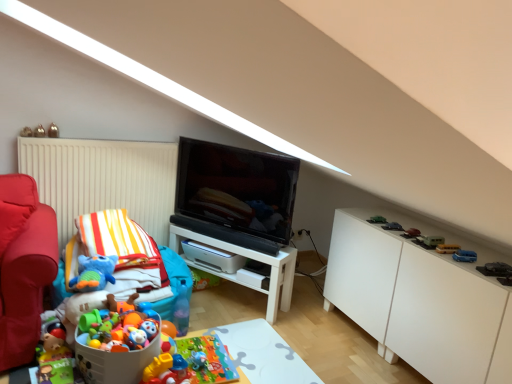
What do you see at coordinates (39, 131) in the screenshot? Image resolution: width=512 pixels, height=384 pixels. I see `metallic gold toy at upper left, which is counted as the 1th toy, starting from the left` at bounding box center [39, 131].

You are a GUI agent. You are given a task and a screenshot of the screen. Output one action in this format:
    pyautogui.click(x=<x>, y=<y>)
    Task: Click on the metallic silver car at upper right, the 6th toy viewed from the right
    
    Given the screenshot: What is the action you would take?
    pyautogui.click(x=392, y=226)

How much space does white matte table at center, marked as the second table in a front-to-back arrangement, occupy horizontally?

white matte table at center, marked as the second table in a front-to-back arrangement, is 10.45 inches in width.

This screenshot has height=384, width=512. What do you see at coordinates (411, 233) in the screenshot?
I see `shiny red car at right, the 8th toy in the left-to-right sequence` at bounding box center [411, 233].

The image size is (512, 384). I want to click on green matte toy car at right, which is the fourth toy from right to left, so click(x=429, y=241).

The image size is (512, 384). I want to click on yellow matte school bus at right, placed as the 6th toy when sorted from bottom to top, so click(x=447, y=248).

Which is more to the left, blue plush toy at left, which is the ninth toy in right-to-left order, or metallic silver toy at upper left, placed as the 12th toy when sorted from bottom to top?

metallic silver toy at upper left, placed as the 12th toy when sorted from bottom to top, is more to the left.

Is blue plush toy at left, arranged as the tenth toy when viewed from the top, positioned before metallic silver toy at upper left, arranged as the 11th toy when viewed from the right?

Yes, blue plush toy at left, arranged as the tenth toy when viewed from the top, is closer to the viewer.

Based on their sizes in the image, would you say blue plush toy at left, marked as the fourth toy in a left-to-right arrangement, is bigger or smaller than metallic silver toy at upper left, which is counted as the 1th toy, starting from the top?

blue plush toy at left, marked as the fourth toy in a left-to-right arrangement, is bigger than metallic silver toy at upper left, which is counted as the 1th toy, starting from the top.

In the scene shown: Which is closer, (105, 282) or (50, 131)?

The point (105, 282) is closer to the camera.

From a real-world perspective, between green matte toy car at right, which is the 6th toy from top to bottom, and matte black tv at center, who is vertically lower?

In real-world perspective, green matte toy car at right, which is the 6th toy from top to bottom, is lower.

Considering the sizes of green matte toy car at right, which appears as the 9th toy when viewed from the left, and matte black tv at center in the image, is green matte toy car at right, which appears as the 9th toy when viewed from the left, bigger or smaller than matte black tv at center?

In the image, green matte toy car at right, which appears as the 9th toy when viewed from the left, appears to be smaller than matte black tv at center.

Looking at this image, what's the angular difference between green matte toy car at right, the 7th toy ordered from the bottom, and matte black tv at center's facing directions?

The angle between the facing direction of green matte toy car at right, the 7th toy ordered from the bottom, and the facing direction of matte black tv at center is 44.2 degrees.

Considering the relative sizes of green matte toy car at right, the 7th toy ordered from the bottom, and matte black tv at center in the image provided, is green matte toy car at right, the 7th toy ordered from the bottom, shorter than matte black tv at center?

Yes, green matte toy car at right, the 7th toy ordered from the bottom, is shorter than matte black tv at center.

Looking at this image, is white matte table at center, the second table in the bottom-to-top sequence, looking in the opposite direction of green matte toy car at right, which appears as the 9th toy when viewed from the left?

That's not correct — white matte table at center, the second table in the bottom-to-top sequence, is not looking away from green matte toy car at right, which appears as the 9th toy when viewed from the left.

Considering the sizes of objects white matte table at center, placed as the 1th table when sorted from top to bottom, and green matte toy car at right, the 7th toy ordered from the bottom, in the image provided, who is thinner, white matte table at center, placed as the 1th table when sorted from top to bottom, or green matte toy car at right, the 7th toy ordered from the bottom,?

With smaller width is green matte toy car at right, the 7th toy ordered from the bottom.

Considering the relative sizes of white matte table at center, marked as the second table in a front-to-back arrangement, and green matte toy car at right, the 7th toy ordered from the bottom, in the image provided, is white matte table at center, marked as the second table in a front-to-back arrangement, smaller than green matte toy car at right, the 7th toy ordered from the bottom,?

Actually, white matte table at center, marked as the second table in a front-to-back arrangement, might be larger than green matte toy car at right, the 7th toy ordered from the bottom.

Can you tell me how much white matte table at center, marked as the 1th table in a back-to-front arrangement, and green matte toy car at right, the 7th toy ordered from the bottom, differ in facing direction?

The angle between the facing direction of white matte table at center, marked as the 1th table in a back-to-front arrangement, and the facing direction of green matte toy car at right, the 7th toy ordered from the bottom, is 44.7 degrees.

In the scene shown: Is yellow matte school bus at right, placed as the 6th toy when sorted from bottom to top, beside metallic gold toy at upper left, the twelfth toy when ordered from right to left?

No, yellow matte school bus at right, placed as the 6th toy when sorted from bottom to top, is not next to metallic gold toy at upper left, the twelfth toy when ordered from right to left.

Between point (453, 244) and point (42, 128), which one is positioned in front?

The point (453, 244) is closer.

Is yellow matte school bus at right, the tenth toy when ordered from left to right, inside or outside of metallic gold toy at upper left, the 11th toy ordered from the bottom?

yellow matte school bus at right, the tenth toy when ordered from left to right, exists outside the volume of metallic gold toy at upper left, the 11th toy ordered from the bottom.

Who is shorter, yellow matte school bus at right, the tenth toy when ordered from left to right, or metallic gold toy at upper left, which is counted as the 1th toy, starting from the left?

yellow matte school bus at right, the tenth toy when ordered from left to right.

Does point (58, 133) lie behind point (23, 286)?

Yes, it is.

Looking at their sizes, would you say metallic silver toy at upper left, arranged as the 11th toy when viewed from the right, is wider or thinner than matte red sofa at left?

Considering their sizes, metallic silver toy at upper left, arranged as the 11th toy when viewed from the right, looks slimmer than matte red sofa at left.

From a real-world perspective, is metallic silver toy at upper left, which is counted as the 1th toy, starting from the top, over matte red sofa at left?

Yes, from a real-world perspective, metallic silver toy at upper left, which is counted as the 1th toy, starting from the top, is on top of matte red sofa at left.

Identify the location of the 2nd toy in front of the matte black tv at center. This screenshot has width=512, height=384. (411, 233).

Is shiny red car at right, the fifth toy when ordered from top to bottom, turned away from matte black tv at center?

No, shiny red car at right, the fifth toy when ordered from top to bottom, is not facing the opposite direction of matte black tv at center.

Which is correct: shiny red car at right, the fifth toy when ordered from top to bottom, is inside matte black tv at center, or outside of it?

shiny red car at right, the fifth toy when ordered from top to bottom, is located beyond the bounds of matte black tv at center.

Which toy is the 5th one when counting from the right side of the translucent plastic blocks at center, which is the 12th toy from top to bottom? Please provide its 2D coordinates.

[(447, 248)]

What's the angular difference between translucent plastic blocks at center, which appears as the eighth toy when viewed from the right, and yellow matte school bus at right, the 7th toy viewed from the top,'s facing directions?

They differ by 126 degrees in their facing directions.

In the image, is translucent plastic blocks at center, which is counted as the fifth toy, starting from the left, positioned in front of or behind yellow matte school bus at right, the third toy viewed from the right?

Clearly, translucent plastic blocks at center, which is counted as the fifth toy, starting from the left, is in front of yellow matte school bus at right, the third toy viewed from the right.

Is translucent plastic blocks at center, which is counted as the fifth toy, starting from the left, looking in the opposite direction of yellow matte school bus at right, the 7th toy viewed from the top?

That's not correct — translucent plastic blocks at center, which is counted as the fifth toy, starting from the left, is not looking away from yellow matte school bus at right, the 7th toy viewed from the top.

What are the coordinates of `the 9th toy below the metallic silver toy at upper left, which is counted as the 1th toy, starting from the top (from a real-world perspective)` in the screenshot? It's located at (93, 273).

From the image's perspective, which toy is the 4th one below the matte black tv at center? Please provide its 2D coordinates.

[(429, 241)]

Consider the image. Considering their positions, is yellow matte school bus at right, the tenth toy when ordered from left to right, positioned closer to plush toy at lower left, the 2th toy positioned from the bottom, than green matte toy car at right, which ranks as the third toy in top-to-bottom order?

green matte toy car at right, which ranks as the third toy in top-to-bottom order.

From the image, which object appears to be farther from yellow matte school bus at right, the tenth toy when ordered from left to right, matte black tv at center or green matte toy car at right, which appears as the 9th toy when viewed from the left?

matte black tv at center lies further to yellow matte school bus at right, the tenth toy when ordered from left to right, than the other object.

When comparing their distances from metallic silver toy at upper left, placed as the second toy when sorted from left to right, does white glossy cabinet at right or white matte table at center, marked as the second table in a front-to-back arrangement, seem closer?

white matte table at center, marked as the second table in a front-to-back arrangement, is closer to metallic silver toy at upper left, placed as the second toy when sorted from left to right.

Which object lies further to the anchor point matte black tv at center, metallic silver car at upper right, the 6th toy viewed from the right, or white glossy cabinet at right?

Among the two, metallic silver car at upper right, the 6th toy viewed from the right, is located further to matte black tv at center.

Based on their spatial positions, is metallic silver car at upper right, the 6th toy viewed from the right, or white matte table at center, placed as the 1th table when sorted from top to bottom, closer to metallic gold toy at upper left, which is counted as the 1th toy, starting from the left?

The object closer to metallic gold toy at upper left, which is counted as the 1th toy, starting from the left, is white matte table at center, placed as the 1th table when sorted from top to bottom.

When comparing their distances from white glossy cabinet at right, does metallic gray car at right, placed as the 12th toy when sorted from left to right, or matte black tv at center seem closer?

Among the two, metallic gray car at right, placed as the 12th toy when sorted from left to right, is located nearer to white glossy cabinet at right.

Which object lies further to the anchor point white glossy cabinet at right, metallic gold toy at upper left, the 11th toy ordered from the bottom, or white matte table at center, marked as the 1th table in a back-to-front arrangement?

Among the two, metallic gold toy at upper left, the 11th toy ordered from the bottom, is located further to white glossy cabinet at right.

Based on their spatial positions, is blue plastic toy car at lower right, the eighth toy from the top, or white plastic table at lower center, which appears as the 2th table when viewed from the top, further from matte black tv at center?

The object further to matte black tv at center is blue plastic toy car at lower right, the eighth toy from the top.

The width and height of the screenshot is (512, 384). I want to click on television between metallic gold toy at upper left, which ranks as the second toy in top-to-bottom order, and white plastic table at lower center, marked as the 2th table in a back-to-front arrangement, vertically, so click(234, 194).

Where is `television situated between white plastic table at lower center, which appears as the 2th table when viewed from the top, and metallic gray car at right, the first toy in the right-to-left sequence, from left to right`? Image resolution: width=512 pixels, height=384 pixels. television situated between white plastic table at lower center, which appears as the 2th table when viewed from the top, and metallic gray car at right, the first toy in the right-to-left sequence, from left to right is located at coordinates (234, 194).

Identify the location of cabinetry between translucent plastic blocks at center, which appears as the eighth toy when viewed from the right, and yellow matte school bus at right, the 7th toy viewed from the top, in the horizontal direction. (419, 303).

Locate an element on the screen. cabinetry located between translucent plastic blocks at center, which is counted as the fifth toy, starting from the left, and blue plastic toy car at lower right, the 5th toy ordered from the bottom, in the left-right direction is located at coordinates (419, 303).